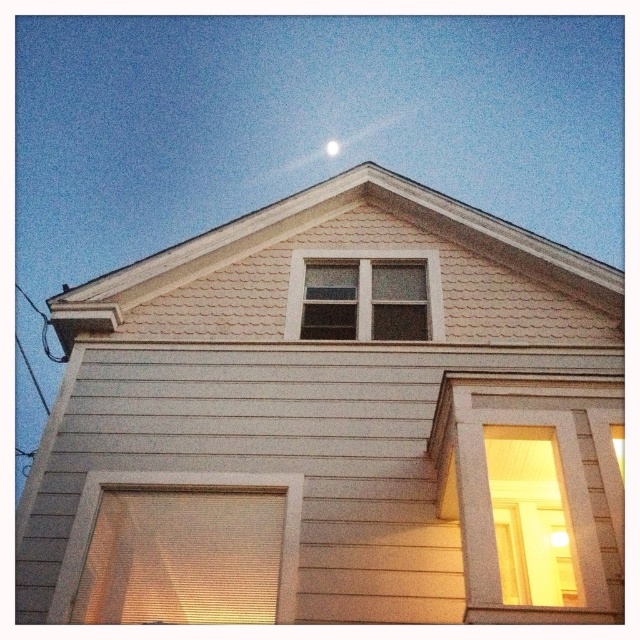
Who is positioned more to the left, white wood siding at lower left or matte wooden door at right?

white wood siding at lower left

What are the coordinates of `white wood siding at lower left` in the screenshot? It's located at (276, 458).

Identify the location of matte wooden door at right. (531, 516).

Which is more to the left, matte wooden door at right or clear glass window at upper center?

clear glass window at upper center

What do you see at coordinates (531, 516) in the screenshot? I see `matte wooden door at right` at bounding box center [531, 516].

Image resolution: width=640 pixels, height=640 pixels. I want to click on matte wooden door at right, so click(531, 516).